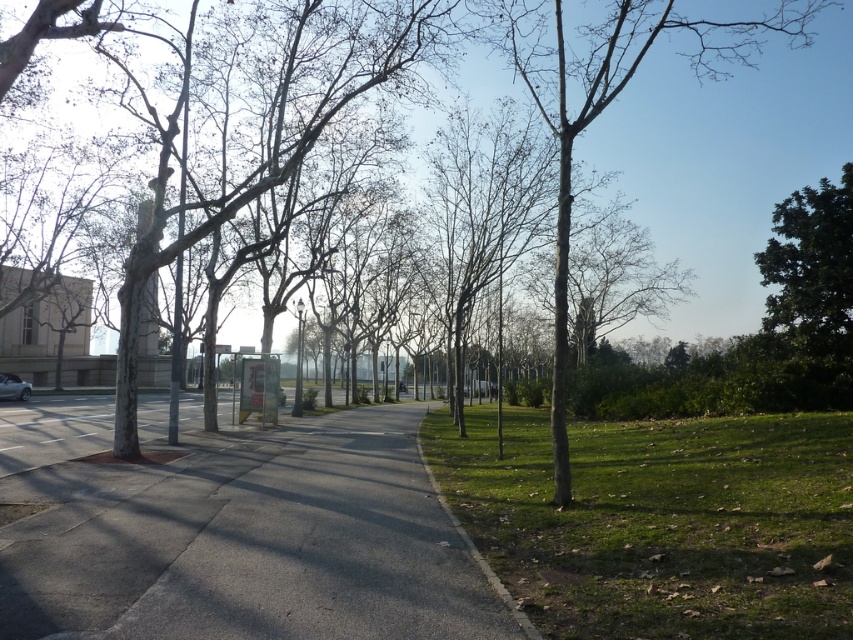
Between green grass at lower right and smooth bark tree at center, which one appears on the right side from the viewer's perspective?

Positioned to the right is smooth bark tree at center.

Does green grass at lower right have a greater height compared to smooth bark tree at center?

Incorrect, green grass at lower right's height is not larger of smooth bark tree at center's.

Does point (463, 464) lie in front of point (602, 100)?

No, it is not.

You are a GUI agent. You are given a task and a screenshot of the screen. Output one action in this format:
    pyautogui.click(x=<x>, y=<y>)
    Task: Click on the green grass at lower right
    This screenshot has width=853, height=640.
    Given the screenshot: What is the action you would take?
    pyautogui.click(x=660, y=522)

Does green grass at lower right have a smaller size compared to silver metallic car at lower left?

Actually, green grass at lower right might be larger than silver metallic car at lower left.

Image resolution: width=853 pixels, height=640 pixels. I want to click on green grass at lower right, so click(660, 522).

At what (x,y) coordinates should I click in order to perform the action: click on green grass at lower right. Please return your answer as a coordinate pair (x, y). This screenshot has height=640, width=853. Looking at the image, I should click on (660, 522).

Can you confirm if smooth bark tree at center is taller than silver metallic car at lower left?

Yes, smooth bark tree at center is taller than silver metallic car at lower left.

Who is higher up, smooth bark tree at center or silver metallic car at lower left?

smooth bark tree at center is above.

Which is in front, point (613, 72) or point (19, 397)?

Point (19, 397)

The width and height of the screenshot is (853, 640). Identify the location of smooth bark tree at center. (614, 96).